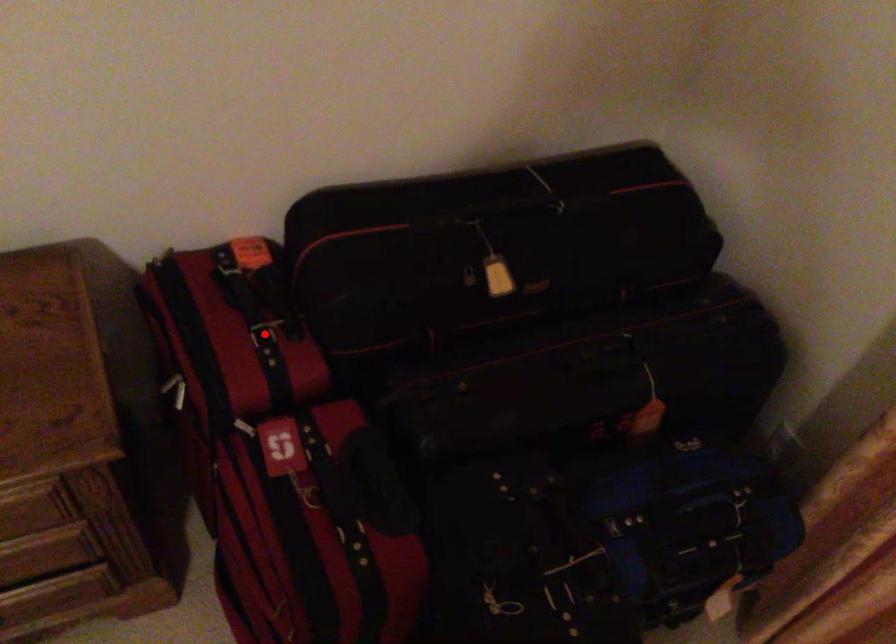
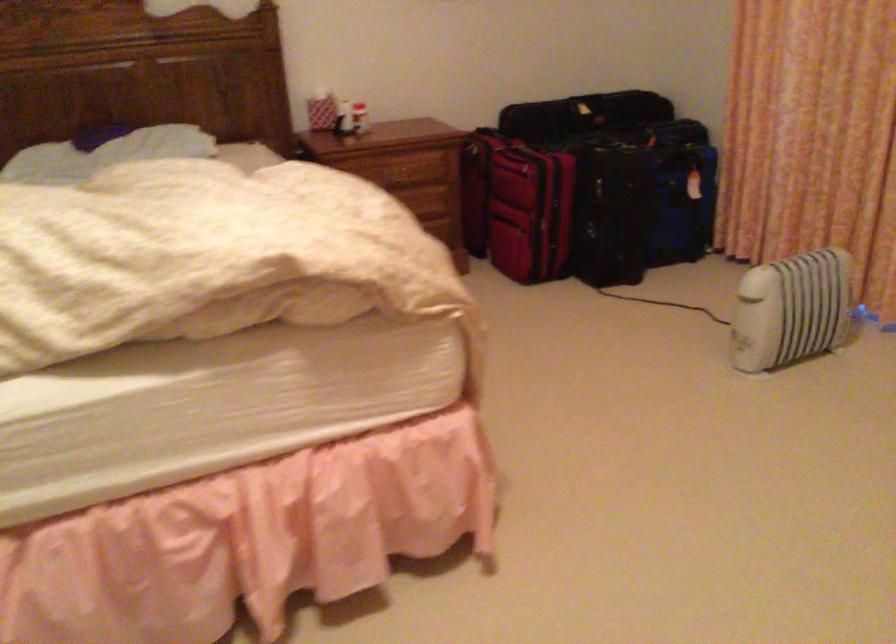
Question: I am providing you with two images of the same scene from different viewpoints. A red point is marked on the first image. Is the red point's position out of view in image 2?

Choices:
 (A) Yes
 (B) No

Answer: (A)